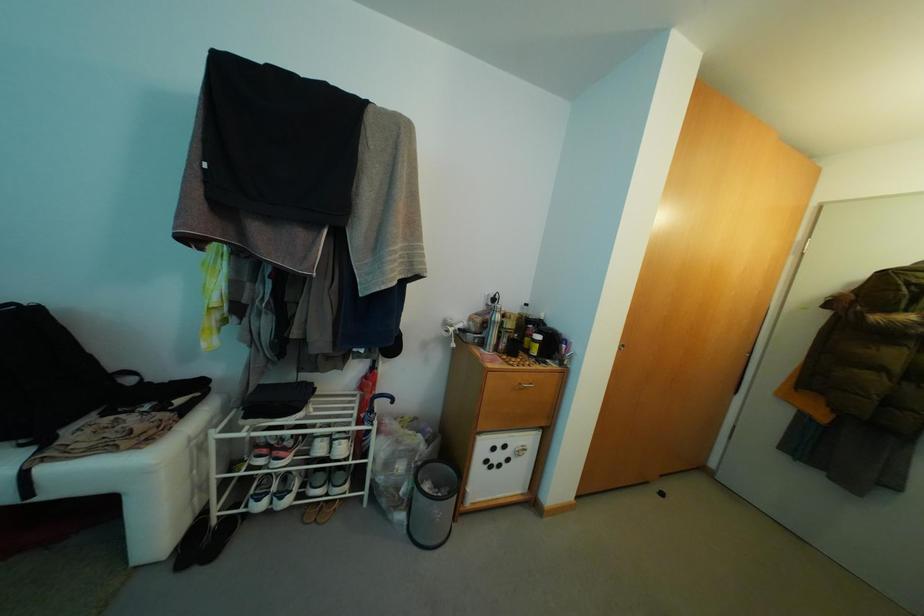
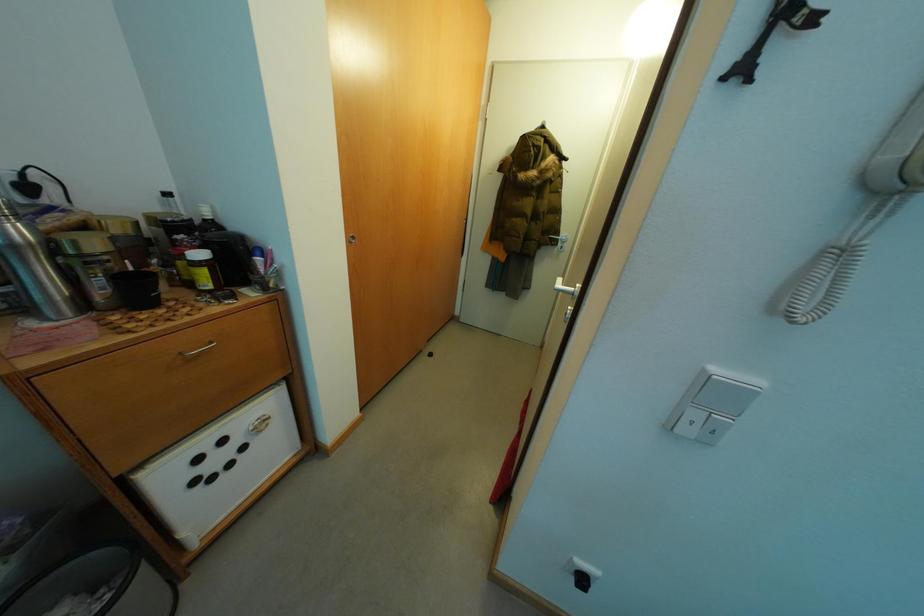
The first image is from the beginning of the video and the second image is from the end. How did the camera likely rotate when shooting the video?

The rotation direction of the camera is right-down.